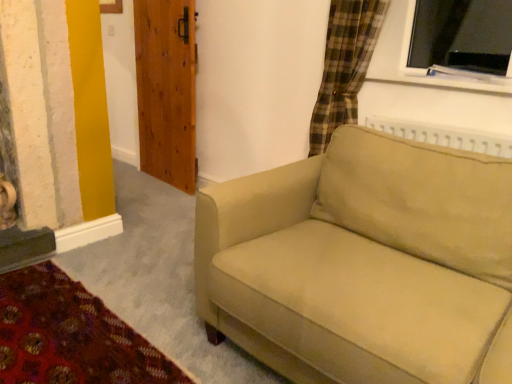
Question: Is beige fabric couch at center at the left side of wooden door at upper left?

Choices:
 (A) yes
 (B) no

Answer: (B)

Question: Is beige fabric couch at center beside wooden door at upper left?

Choices:
 (A) yes
 (B) no

Answer: (B)

Question: Is beige fabric couch at center oriented towards wooden door at upper left?

Choices:
 (A) no
 (B) yes

Answer: (A)

Question: From the image's perspective, is beige fabric couch at center located beneath wooden door at upper left?

Choices:
 (A) no
 (B) yes

Answer: (B)

Question: Is wooden door at upper left at the back of beige fabric couch at center?

Choices:
 (A) no
 (B) yes

Answer: (A)

Question: Is beige fabric couch at center positioned behind wooden door at upper left?

Choices:
 (A) yes
 (B) no

Answer: (B)

Question: Can you confirm if wooden door at upper left is wider than beige fabric couch at center?

Choices:
 (A) yes
 (B) no

Answer: (B)

Question: Is wooden door at upper left oriented towards beige fabric couch at center?

Choices:
 (A) no
 (B) yes

Answer: (A)

Question: Could beige fabric couch at center be considered to be inside wooden door at upper left?

Choices:
 (A) no
 (B) yes

Answer: (A)

Question: From a real-world perspective, is wooden door at upper left over beige fabric couch at center?

Choices:
 (A) no
 (B) yes

Answer: (B)

Question: Would you say wooden door at upper left is a long distance from beige fabric couch at center?

Choices:
 (A) no
 (B) yes

Answer: (B)

Question: Does wooden door at upper left have a lesser width compared to beige fabric couch at center?

Choices:
 (A) no
 (B) yes

Answer: (B)

Question: Would you say wooden door at upper left is inside or outside beige fabric couch at center?

Choices:
 (A) outside
 (B) inside

Answer: (A)